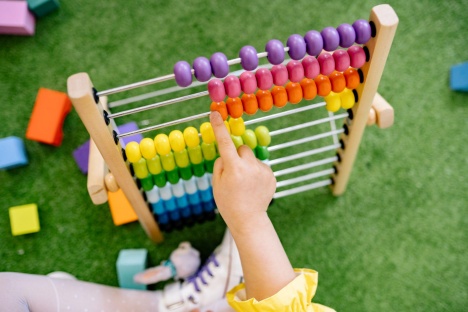
Identify the location of pink bead. (215, 90), (230, 85), (245, 82), (267, 81), (277, 78), (292, 71), (308, 68), (328, 63), (343, 60), (356, 57).